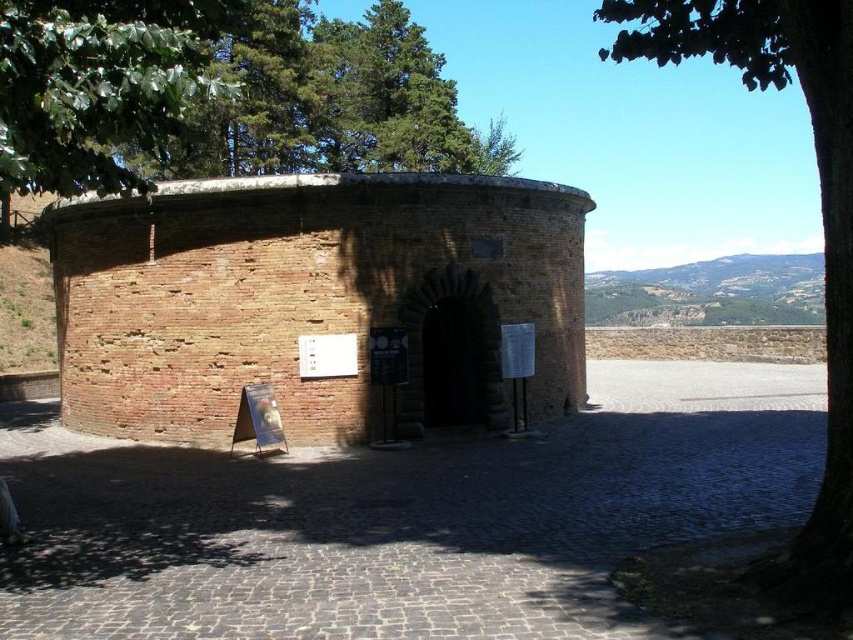
You are a maintenance worker needing to inspect the green leafy tree at upper right and the dark brown stone arch at center. You have a ladder that is 9 meters long. Can you use the ladder to reach both objects without moving it?

The distance between the green leafy tree at upper right and the dark brown stone arch at center is 8.88 meters. Since the ladder is 9 meters long, it is slightly longer than the distance between them. Therefore, the ladder can be positioned to reach both objects without needing to be moved.

You are an architect examining the historical site. You notice the red brick fort at center and the green leafy tree at upper right. Which object takes up more horizontal space in the image?

The green leafy tree at upper right takes up more horizontal space than the red brick fort at center because the red brick fort at center has a lesser width compared to green leafy tree at upper right.